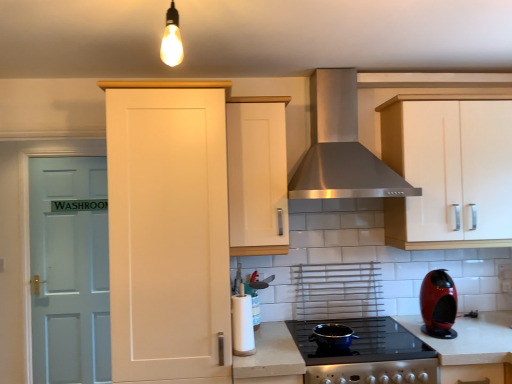
What are the coordinates of `vacant area on top of stainless steel range hood at center (from a real-world perspective)` in the screenshot? It's located at (343, 55).